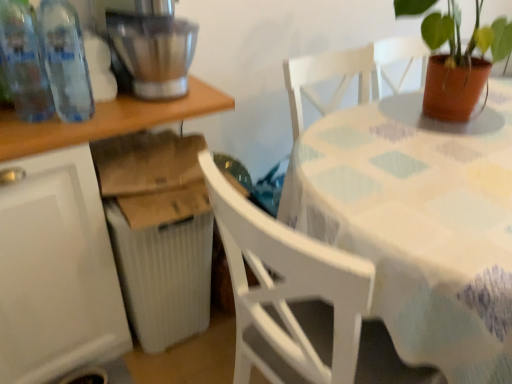
Image resolution: width=512 pixels, height=384 pixels. I want to click on vacant space in front of transparent plastic bottles at left, which is counted as the first bottle, starting from the right, so click(55, 133).